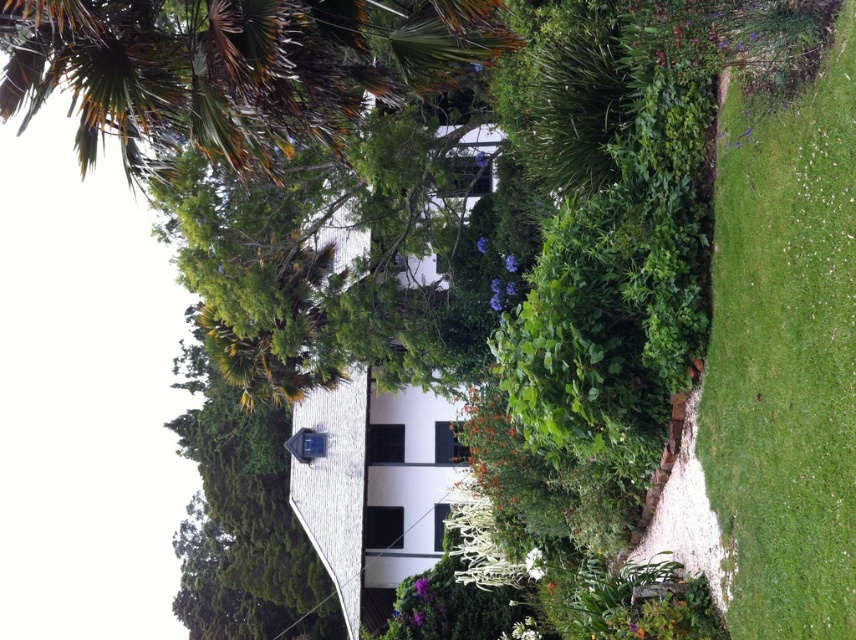
Question: Among these points, which one is nearest to the camera?

Choices:
 (A) (125, 17)
 (B) (824, 458)

Answer: (B)

Question: Which object is closer to the camera taking this photo?

Choices:
 (A) green grass at right
 (B) brown textured palm tree at upper left

Answer: (A)

Question: Does green grass at right have a smaller size compared to brown textured palm tree at upper left?

Choices:
 (A) yes
 (B) no

Answer: (A)

Question: Which point is closer to the camera?

Choices:
 (A) brown textured palm tree at upper left
 (B) green grass at right

Answer: (B)

Question: Can you confirm if green grass at right is positioned above brown textured palm tree at upper left?

Choices:
 (A) yes
 (B) no

Answer: (B)

Question: Can you confirm if green grass at right is positioned above brown textured palm tree at upper left?

Choices:
 (A) yes
 (B) no

Answer: (B)